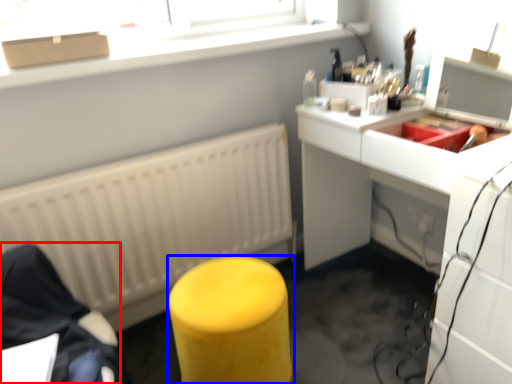
Question: Which point is further to the camera, furniture (highlighted by a red box) or furniture (highlighted by a blue box)?

Choices:
 (A) furniture
 (B) furniture

Answer: (A)